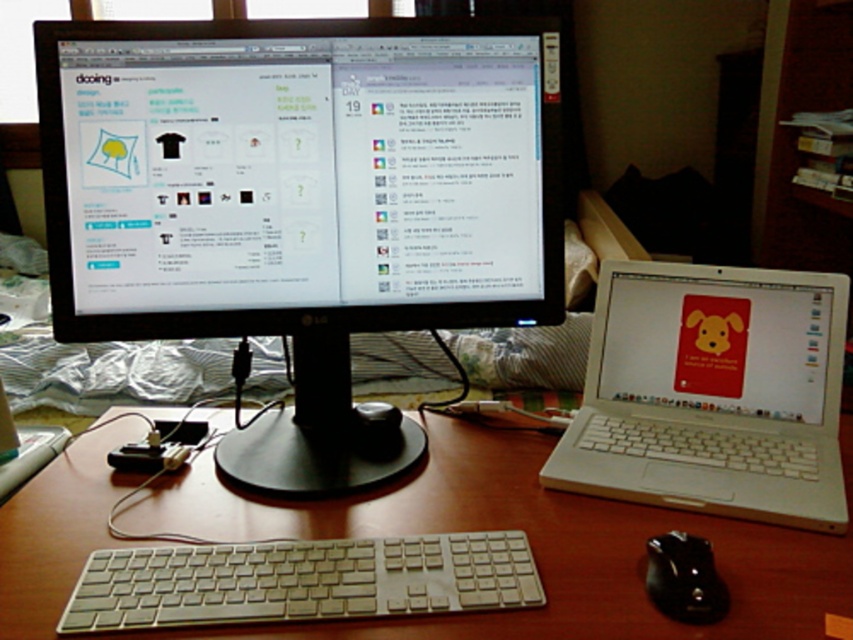
Question: Based on their relative distances, which object is farther from the white plastic keyboard at center?

Choices:
 (A) black glossy monitor at upper left
 (B) wooden desk at center

Answer: (A)

Question: Is black glossy monitor at upper left smaller than wooden desk at center?

Choices:
 (A) no
 (B) yes

Answer: (A)

Question: Is black glossy monitor at upper left positioned in front of black rubber mouse at lower right?

Choices:
 (A) yes
 (B) no

Answer: (B)

Question: Estimate the real-world distances between objects in this image. Which object is closer to the white plastic laptop at right?

Choices:
 (A) white plastic keyboard at center
 (B) black glossy monitor at upper left
 (C) wooden desk at center
 (D) black rubber mouse at lower right

Answer: (C)

Question: Is black glossy monitor at upper left in front of white plastic laptop at right?

Choices:
 (A) no
 (B) yes

Answer: (A)

Question: Which of the following is the closest to the observer?

Choices:
 (A) wooden desk at center
 (B) white plastic laptop at right
 (C) black glossy monitor at upper left

Answer: (A)